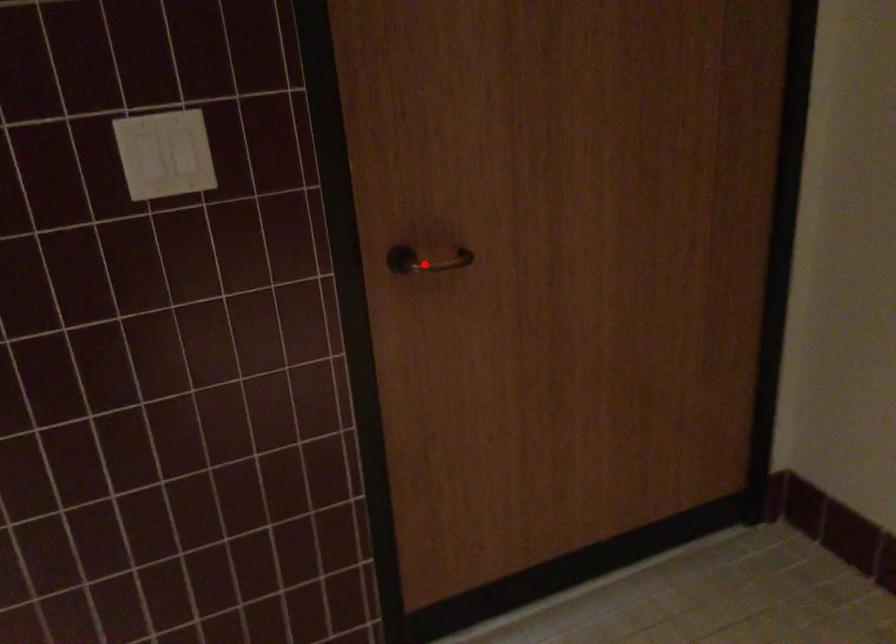
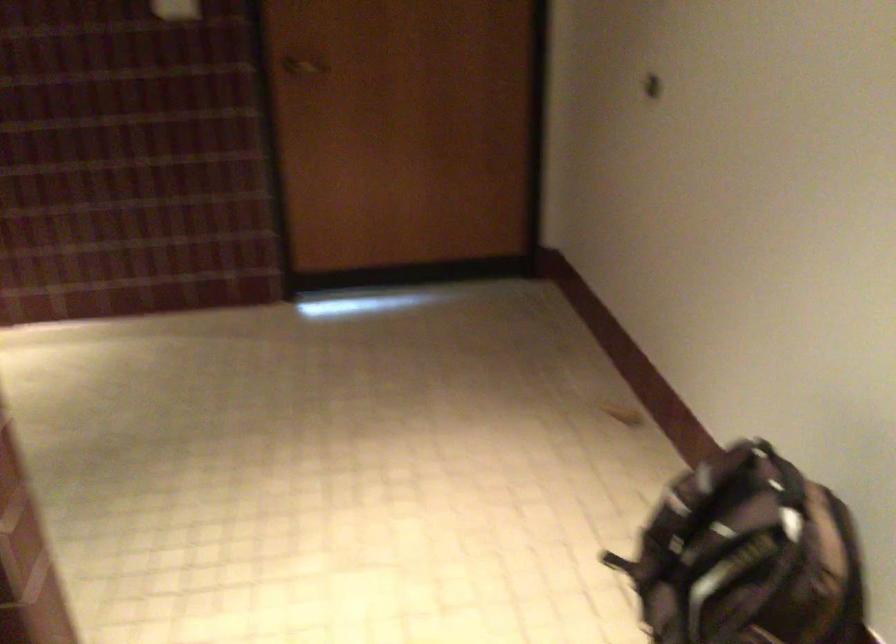
Locate, in the second image, the point that corresponds to the highlighted location in the first image.

(304, 66)